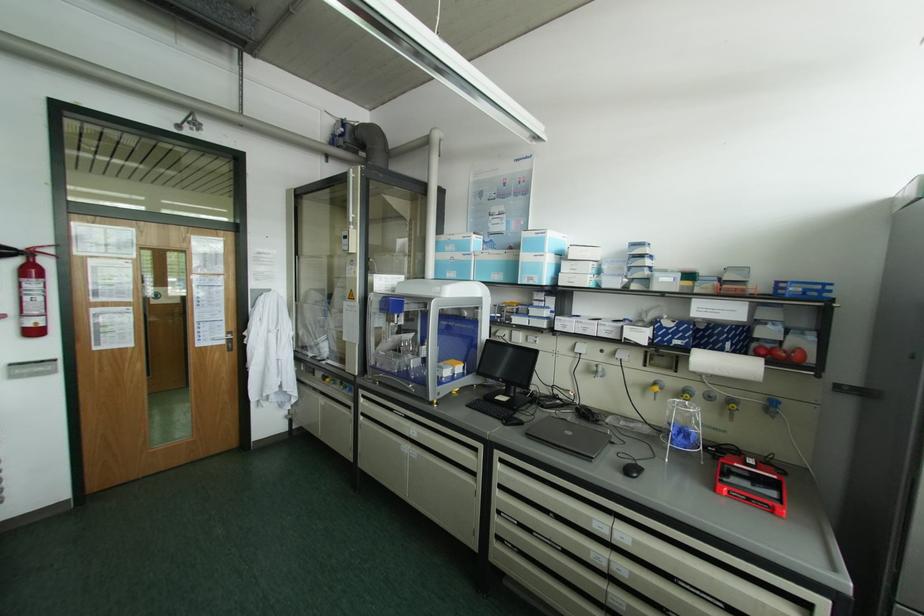
Describe the element at coordinates (10, 252) in the screenshot. The width and height of the screenshot is (924, 616). I see `the extinguisher handle` at that location.